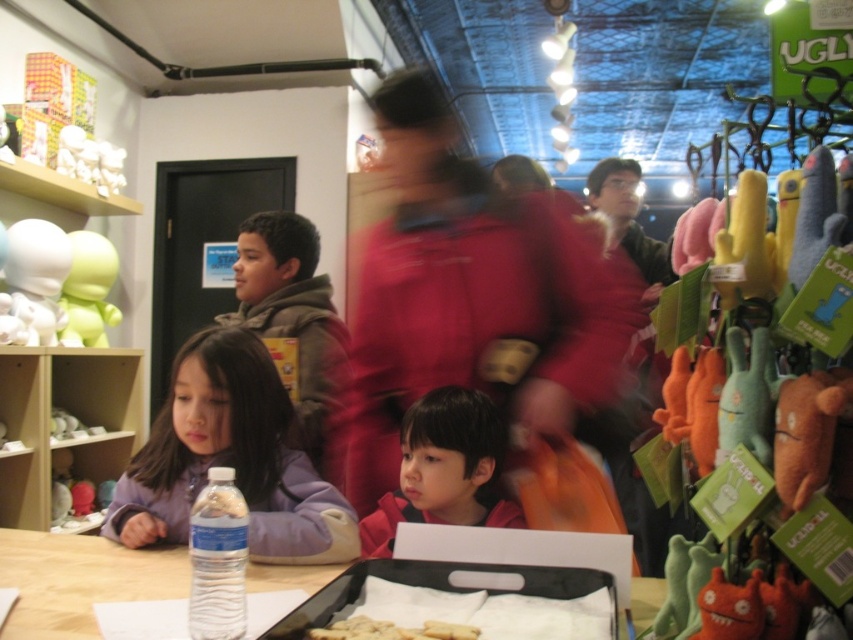
You are standing at point (65, 417) and want to walk to the exit located at point (329, 605). Is the exit in front of you or behind you?

The exit at point (329, 605) is in front of you because it is located in front of your current position at point (65, 417).

You are a delivery robot standing at the entrance of the store. You need to deliver a package to the point marked as point (526, 592). The robot has a maximum reach distance of 1 meter. Can you reach that point without moving closer?

The distance of point (526, 592) from the viewer is 97.80 centimeters, which is within the robot maximum reach distance of 1 meter. Therefore, the robot can reach the point without moving closer.

You are a delivery robot with a 2.5 feet wide package. You need to move from the entrance to the table where the matte white figurine at left and white crumbly bread at center are located. Can you navigate the space between these two items?

The distance between the matte white figurine at left and white crumbly bread at center is 7.67 feet. Since your package is only 2.5 feet wide, there is ample space to navigate between them.